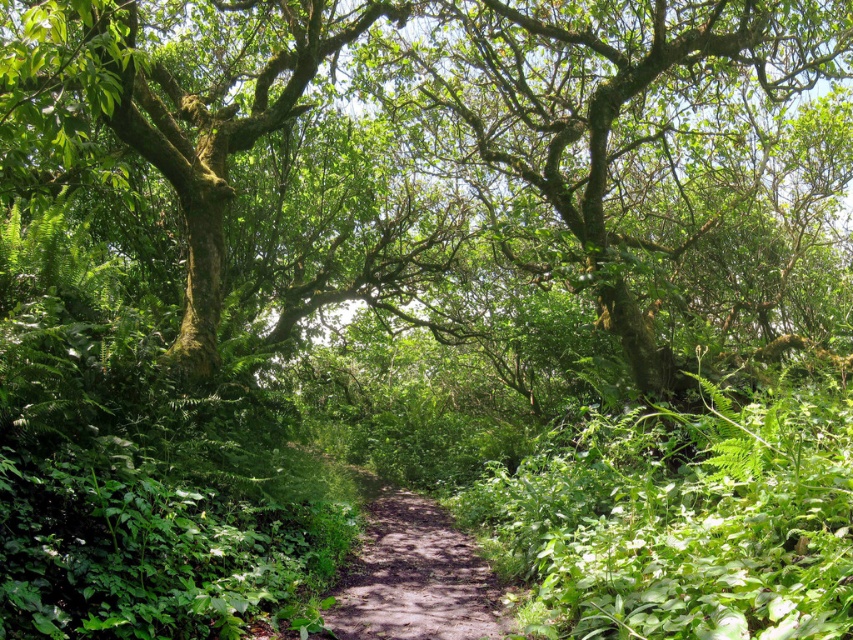
You are a hiker standing on the dirt path at center. You look up and see the green mossy tree at center. Which one is higher in height?

The green mossy tree at center is taller than the dirt path at center.

You are a hiker walking along the dirt path at center. You notice the green mossy tree at center blocking your way. Can you walk around it to continue along the path?

The green mossy tree at center is in front of the dirt path at center, so it is blocking the path. To continue along the dirt path at center, you would need to walk around the green mossy tree at center to either side.